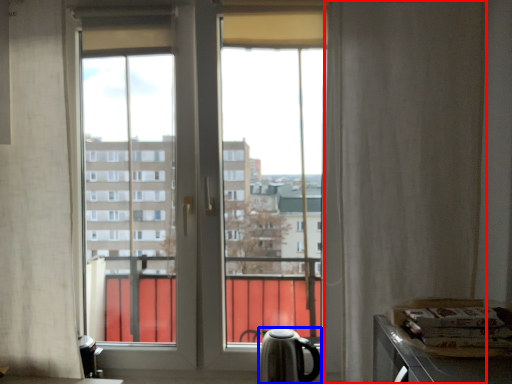
Question: Which of the following is the closest to the observer, curtain (highlighted by a red box) or tea pot (highlighted by a blue box)?

Choices:
 (A) curtain
 (B) tea pot

Answer: (A)